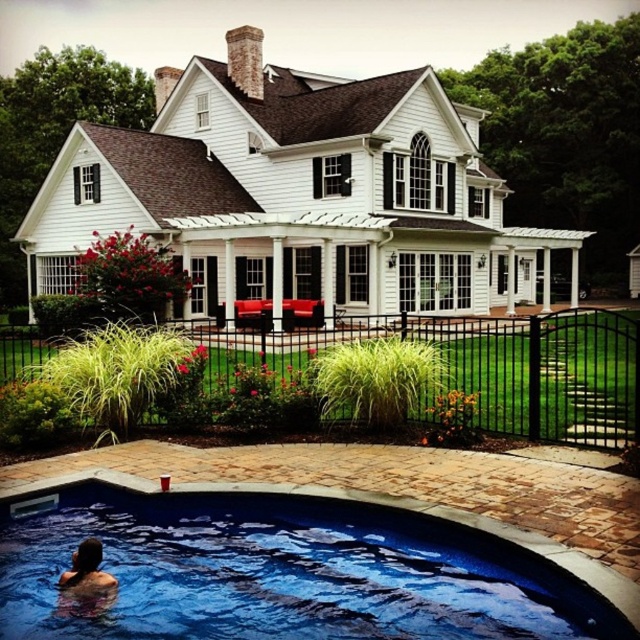
Can you confirm if blue smooth water at lower center is thinner than smooth skin person at lower left?

In fact, blue smooth water at lower center might be wider than smooth skin person at lower left.

Between blue smooth water at lower center and smooth skin person at lower left, which one appears on the right side from the viewer's perspective?

blue smooth water at lower center

This screenshot has height=640, width=640. I want to click on blue smooth water at lower center, so click(x=291, y=570).

At what (x,y) coordinates should I click in order to perform the action: click on blue smooth water at lower center. Please return your answer as a coordinate pair (x, y). The image size is (640, 640). Looking at the image, I should click on (291, 570).